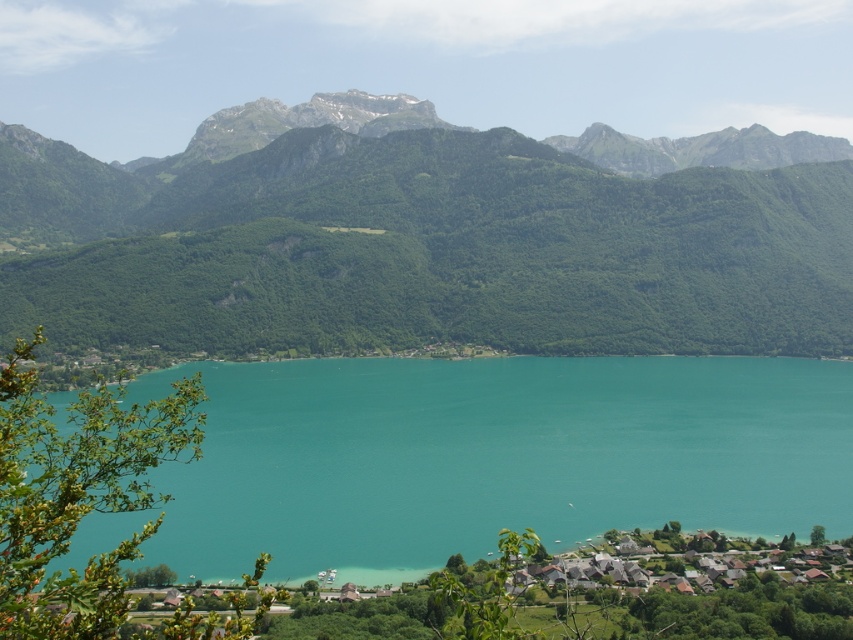
You are standing at the center of the village and want to hike towards the green forested mountain at center. Which direction should you head?

The green forested mountain at center is located at point coordinates, so you should head towards the center direction to reach it.

You are standing at the edge of the lake and want to take a photo of the green forested mountain at center. Which direction should you face to capture it in your viewfinder?

The green forested mountain at center is located at coordinates point (x=433, y=237), so you should face towards the center of the image to capture it in your viewfinder.

You are a hiker standing at the edge of the lake. You notice the green forested mountain at center and the turquoise water at center. Which one appears taller from your vantage point?

The green forested mountain at center appears taller than the turquoise water at center from your vantage point because it has a greater height compared to the turquoise water at center.